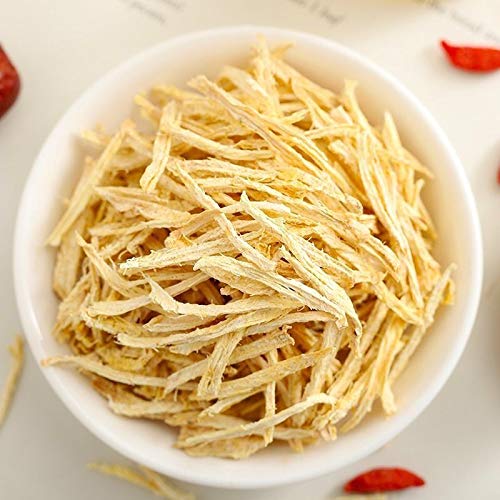
In order to click on inside of bowl in this screenshot , I will do `click(372, 97)`.